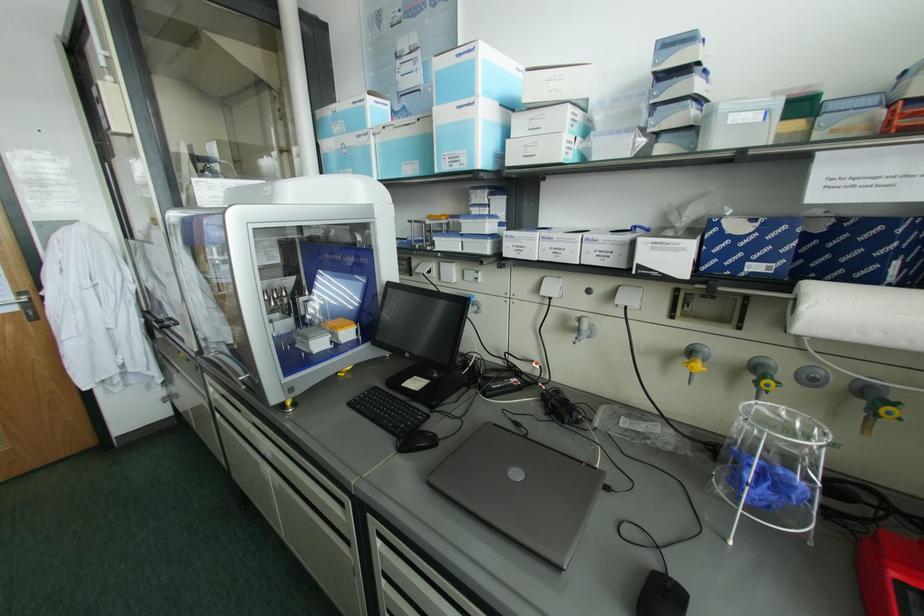
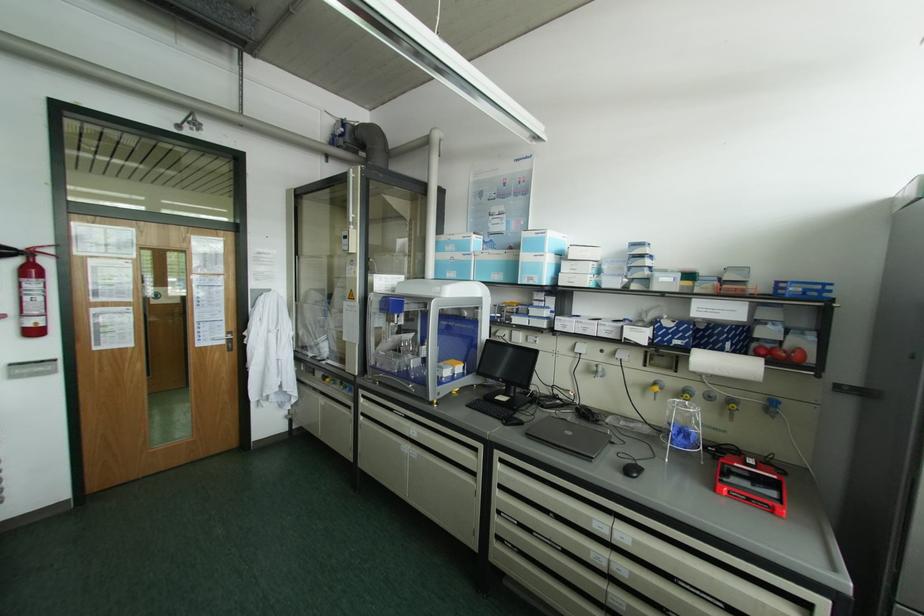
Find the pixel in the second image that matches point 698,365 in the first image.

(655, 387)